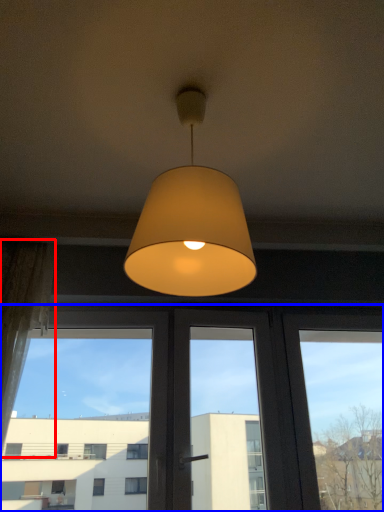
Question: Which point is further to the camera, curtain (highlighted by a red box) or window (highlighted by a blue box)?

Choices:
 (A) curtain
 (B) window

Answer: (B)